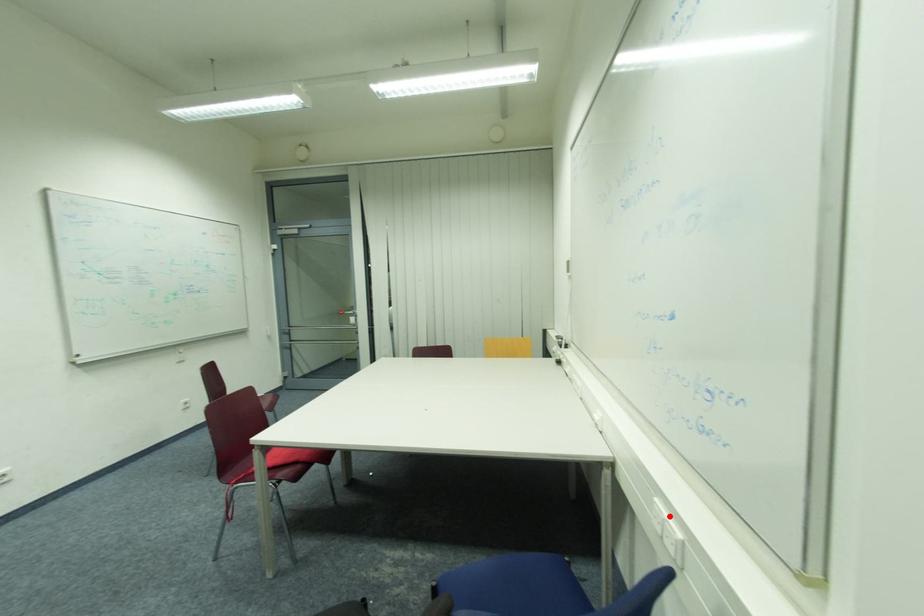
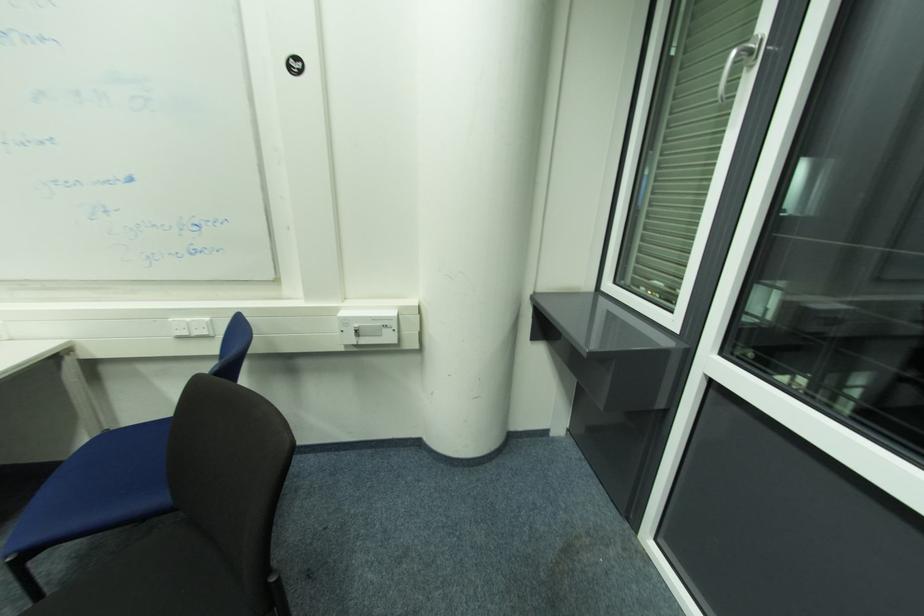
The point at the highlighted location is marked in the first image. Where is the corresponding point in the second image?

(191, 320)